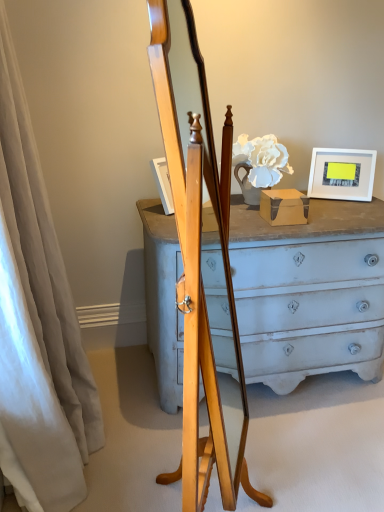
Question: Can you confirm if white matte picture frame at upper right is smaller than white fabric curtain at left?

Choices:
 (A) yes
 (B) no

Answer: (A)

Question: Is white matte picture frame at upper right positioned with its back to white fabric curtain at left?

Choices:
 (A) no
 (B) yes

Answer: (A)

Question: Can you confirm if white matte picture frame at upper right is taller than white fabric curtain at left?

Choices:
 (A) yes
 (B) no

Answer: (B)

Question: Would you say white matte picture frame at upper right is outside white fabric curtain at left?

Choices:
 (A) no
 (B) yes

Answer: (B)

Question: Is white fabric curtain at left surrounded by white matte picture frame at upper right?

Choices:
 (A) yes
 (B) no

Answer: (B)

Question: From the image's perspective, is white matte picture frame at upper right located beneath white fabric curtain at left?

Choices:
 (A) yes
 (B) no

Answer: (B)

Question: Is white fabric curtain at left completely or partially outside of white matte picture frame at upper right?

Choices:
 (A) no
 (B) yes

Answer: (B)

Question: Is white fabric curtain at left directly adjacent to white matte picture frame at upper right?

Choices:
 (A) no
 (B) yes

Answer: (A)

Question: Is white fabric curtain at left wider than white matte picture frame at upper right?

Choices:
 (A) yes
 (B) no

Answer: (A)

Question: Considering the relative positions of white fabric curtain at left and white matte picture frame at upper right in the image provided, is white fabric curtain at left to the right of white matte picture frame at upper right from the viewer's perspective?

Choices:
 (A) yes
 (B) no

Answer: (B)

Question: Is white fabric curtain at left oriented away from white matte picture frame at upper right?

Choices:
 (A) yes
 (B) no

Answer: (B)

Question: Does white fabric curtain at left have a smaller size compared to white matte picture frame at upper right?

Choices:
 (A) no
 (B) yes

Answer: (A)

Question: Is white fabric curtain at left wider or thinner than white matte picture frame at upper right?

Choices:
 (A) thin
 (B) wide

Answer: (B)